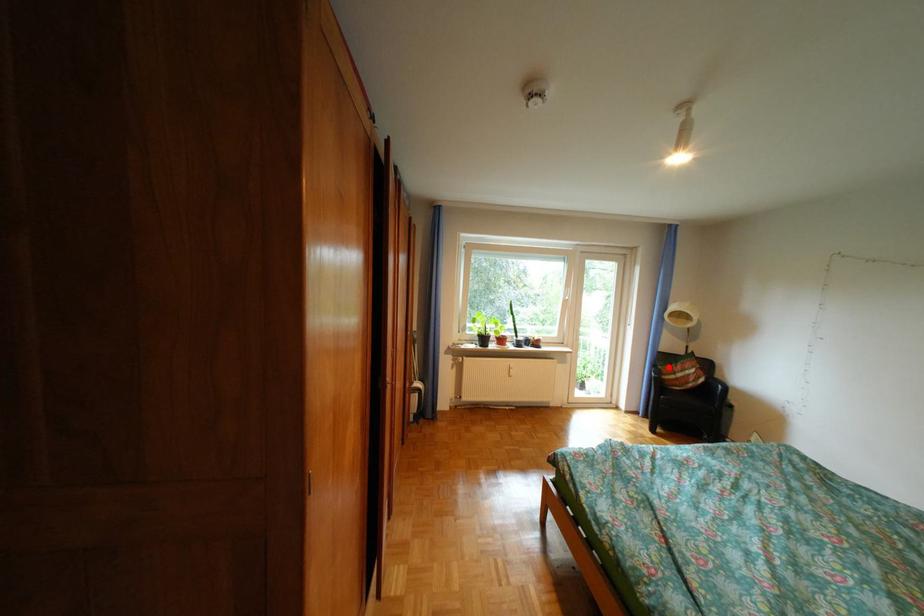
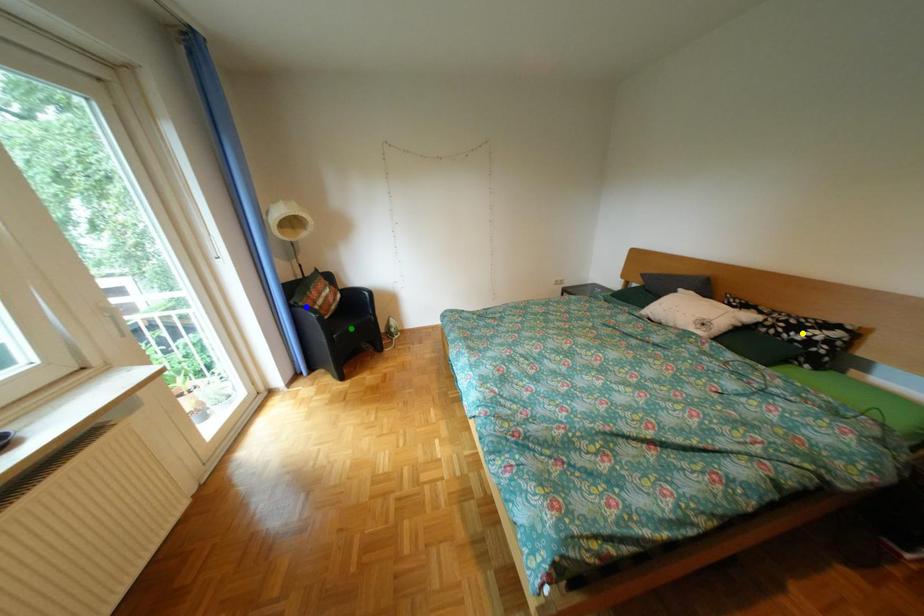
Question: I am providing you with two images of the same scene from different viewpoints. A red point is marked on the first image. You are given multiple points on the second image. Can you choose the point in image 2 that corresponds to the point in image 1?

Choices:
 (A) yellow point
 (B) green point
 (C) blue point

Answer: (C)